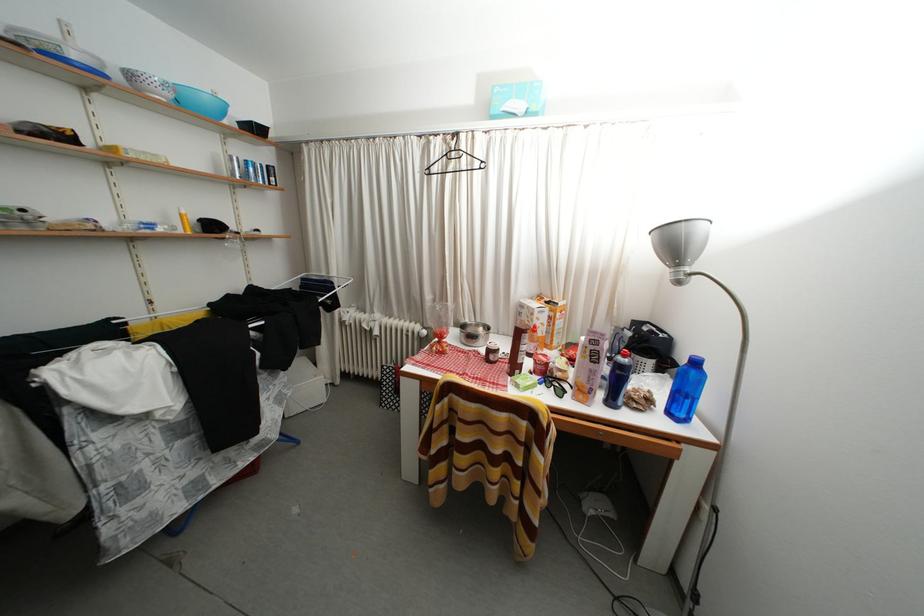
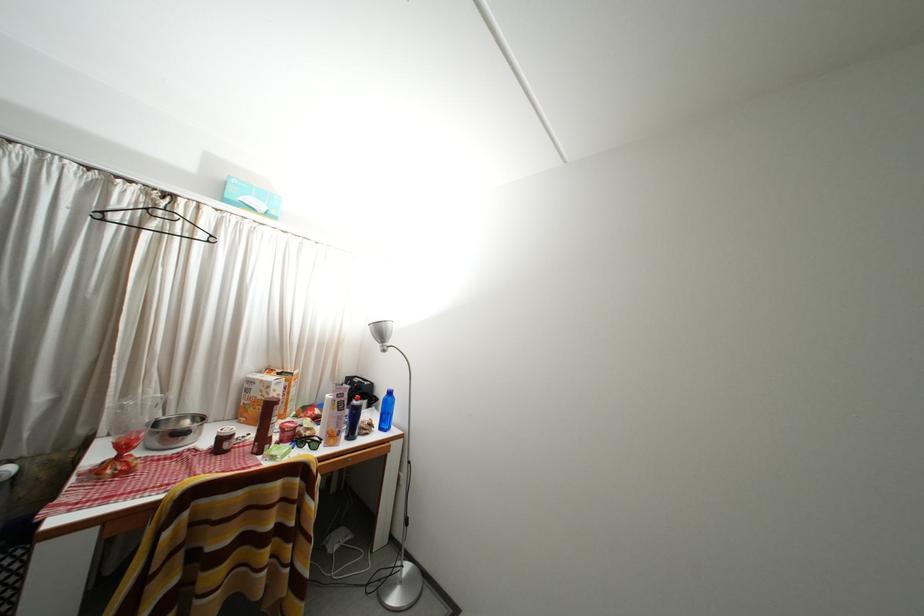
In the second image, find the point that corresponds to the point at 458,172 in the first image.

(161, 230)